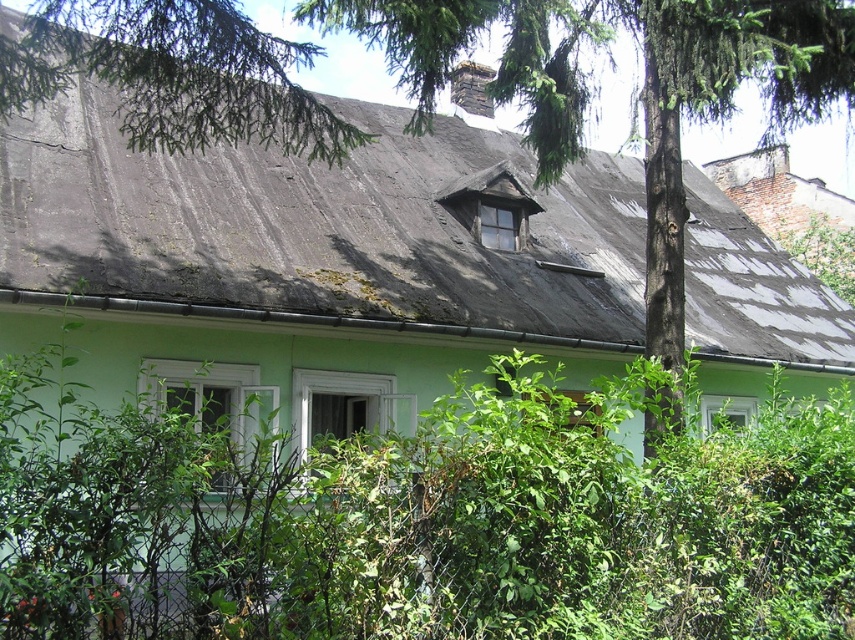
Question: Which point is farther to the camera?

Choices:
 (A) gray shingles at upper center
 (B) green leafy bush at center

Answer: (A)

Question: Which point is farther to the camera?

Choices:
 (A) green leafy bush at center
 (B) gray shingles at upper center

Answer: (B)

Question: Is green leafy bush at center below gray shingles at upper center?

Choices:
 (A) yes
 (B) no

Answer: (A)

Question: Observing the image, what is the correct spatial positioning of green leafy bush at center in reference to gray shingles at upper center?

Choices:
 (A) right
 (B) left

Answer: (B)

Question: Does green leafy bush at center have a lesser width compared to gray shingles at upper center?

Choices:
 (A) no
 (B) yes

Answer: (B)